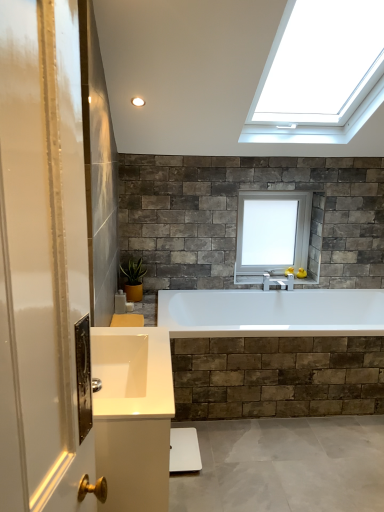
Question: Is white glossy sink at lower left taller or shorter than white glass window at upper center?

Choices:
 (A) short
 (B) tall

Answer: (A)

Question: Is white glossy sink at lower left bigger or smaller than white glass window at upper center?

Choices:
 (A) big
 (B) small

Answer: (B)

Question: Based on their relative distances, which object is nearer to the white glossy sink at lower left?

Choices:
 (A) green matte plant at lower left
 (B) white glass window at upper center

Answer: (A)

Question: Based on their relative distances, which object is nearer to the white glossy sink at lower left?

Choices:
 (A) green matte plant at lower left
 (B) white glass window at upper center

Answer: (A)